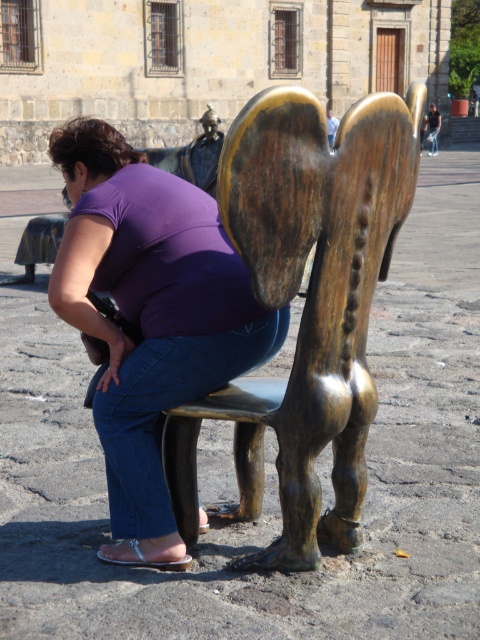
Between bronze statue at center and purple fabric at center, which one has more height?

Standing taller between the two is purple fabric at center.

Between bronze statue at center and purple fabric at center, which one is positioned lower?

purple fabric at center

Describe the element at coordinates (304, 307) in the screenshot. I see `bronze statue at center` at that location.

Where is `bronze statue at center`? The width and height of the screenshot is (480, 640). bronze statue at center is located at coordinates (x=304, y=307).